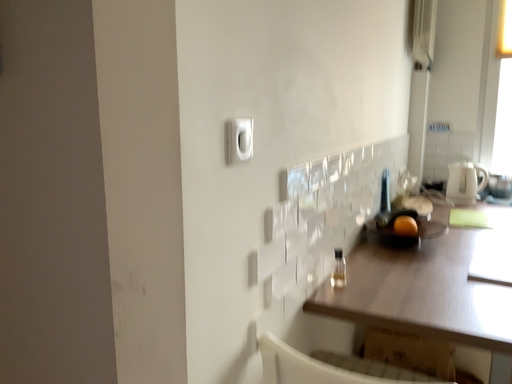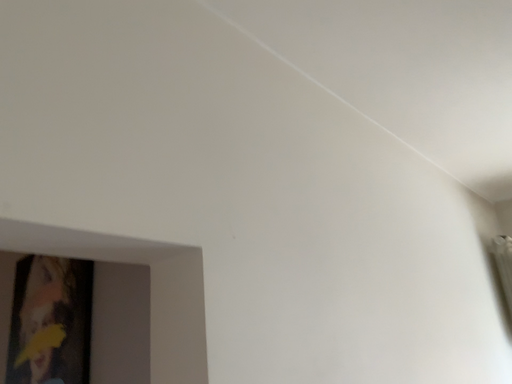
Question: Which way did the camera rotate in the video?

Choices:
 (A) rotated right
 (B) rotated left

Answer: (B)